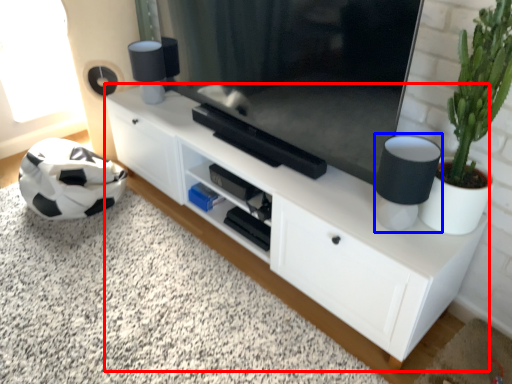
Question: Which of the following is the farthest to the observer, cabinetry (highlighted by a red box) or lamp (highlighted by a blue box)?

Choices:
 (A) cabinetry
 (B) lamp

Answer: (A)